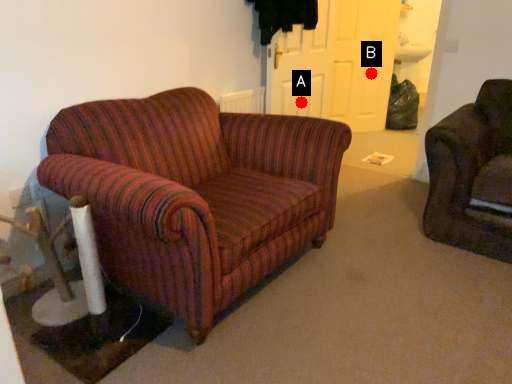
Question: Two points are circled on the image, labeled by A and B beside each circle. Which point is closer to the camera taking this photo?

Choices:
 (A) A is closer
 (B) B is closer

Answer: (A)